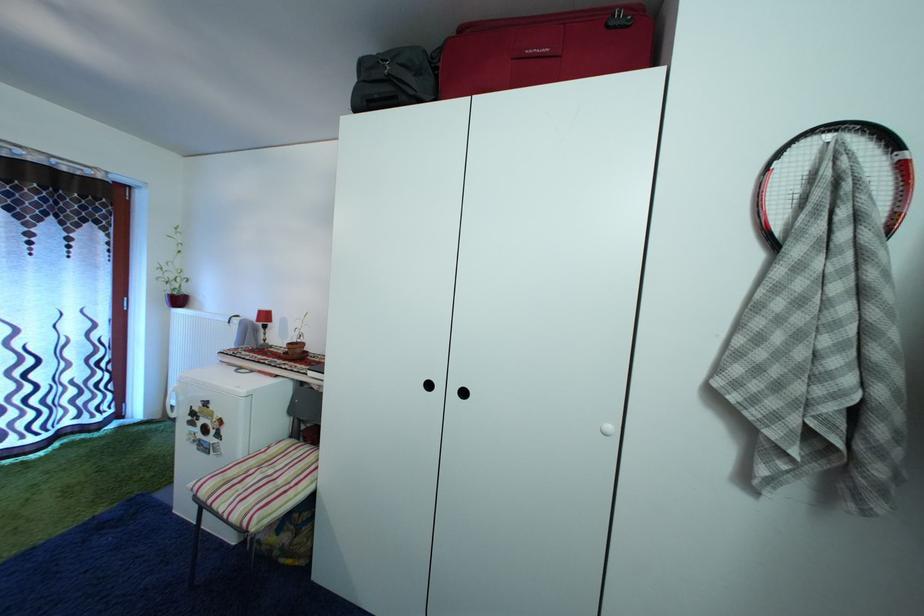
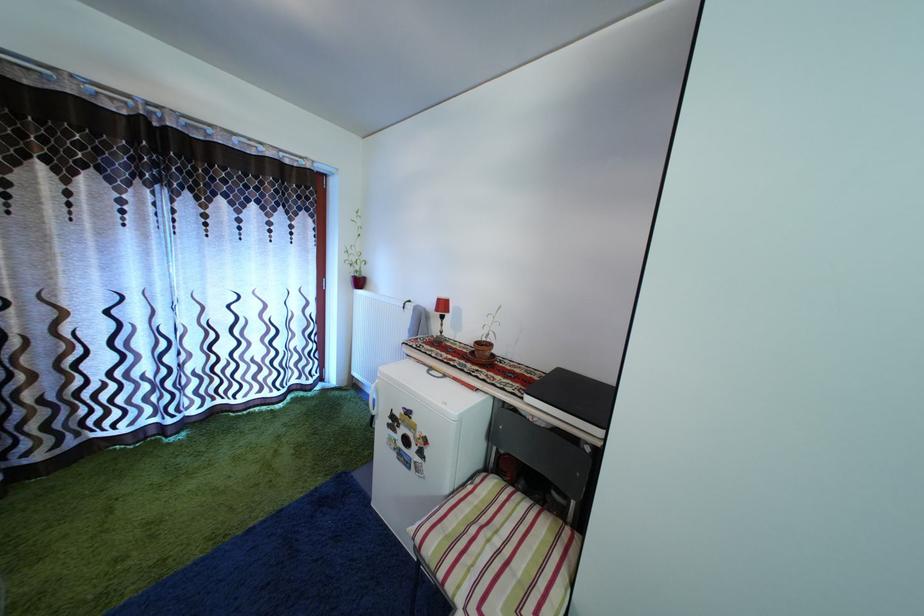
The point at [268,320] is marked in the first image. Where is the corresponding point in the second image?

(446, 308)